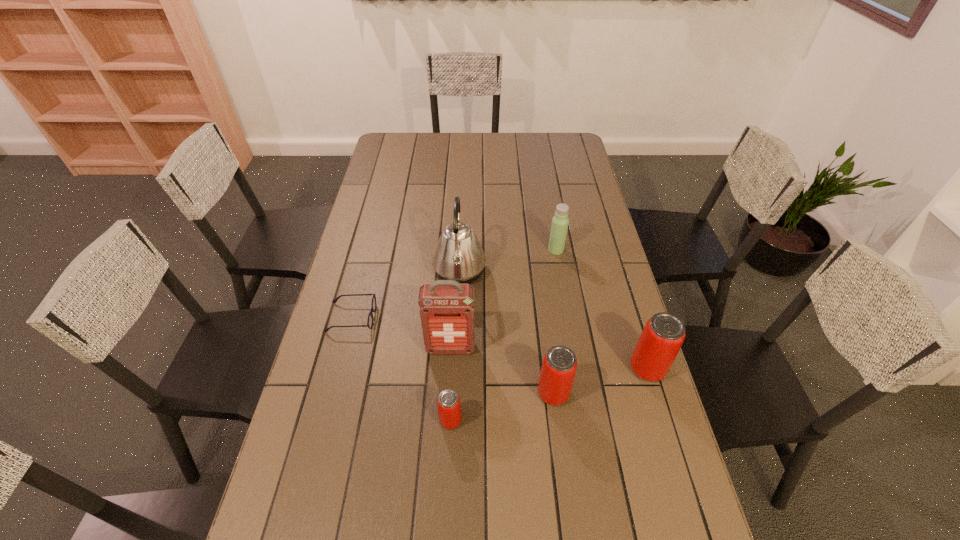
The height and width of the screenshot is (540, 960). Find the location of `vacant space at the far edge of the desktop`. vacant space at the far edge of the desktop is located at coordinates (494, 135).

Identify the location of vacant space at the near edge. This screenshot has width=960, height=540. (420, 530).

In the image, there is a desktop. Where is `free space at the left edge`? The height and width of the screenshot is (540, 960). free space at the left edge is located at coordinates (378, 187).

Find the location of a particular element. This screenshot has width=960, height=540. free point at the right edge is located at coordinates (581, 235).

This screenshot has width=960, height=540. I want to click on free region at the far left corner, so click(385, 153).

Locate an element on the screen. The image size is (960, 540). vacant position at the far right corner of the desktop is located at coordinates (550, 142).

In the image, there is a desktop. Where is `free region at the near right corner`? This screenshot has width=960, height=540. free region at the near right corner is located at coordinates (x=638, y=519).

Where is `free space between the fifth nearest object and the first-aid kit`? The image size is (960, 540). free space between the fifth nearest object and the first-aid kit is located at coordinates (401, 333).

This screenshot has height=540, width=960. I want to click on empty space between the first-aid kit and the second beer can from left to right, so click(502, 370).

The image size is (960, 540). I want to click on free space between the third object from right to left and the thermos bottle, so click(x=555, y=321).